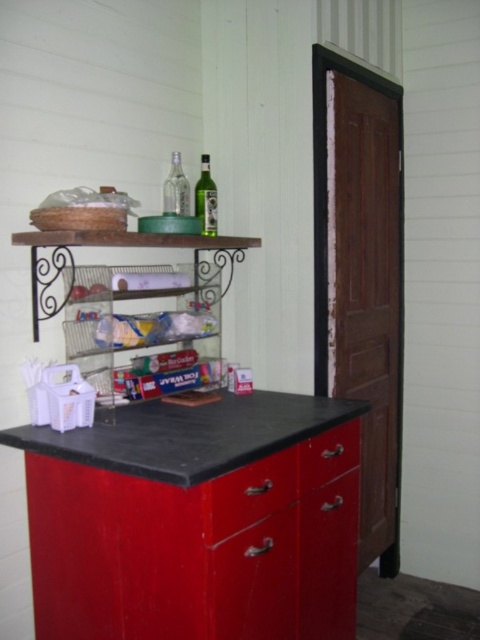
Question: Which of the following is the farthest from the observer?

Choices:
 (A) green glass bottle at upper center
 (B) metallic red drawer at lower center
 (C) black matte counter top at center

Answer: (A)

Question: Can you confirm if metallic red drawer at lower center is bigger than green glass bottle at upper center?

Choices:
 (A) yes
 (B) no

Answer: (A)

Question: Can you confirm if metallic red drawer at lower center is smaller than matte red drawer at center?

Choices:
 (A) yes
 (B) no

Answer: (B)

Question: Which of these objects is positioned closest to the black matte counter top at center?

Choices:
 (A) matte red drawer at center
 (B) metallic red drawer at lower center

Answer: (B)

Question: Among these points, which one is farthest from the camera?

Choices:
 (A) (184, 184)
 (B) (212, 180)

Answer: (B)

Question: Can you confirm if green glass bottle at upper center is positioned above clear glass bottle at upper center?

Choices:
 (A) yes
 (B) no

Answer: (B)